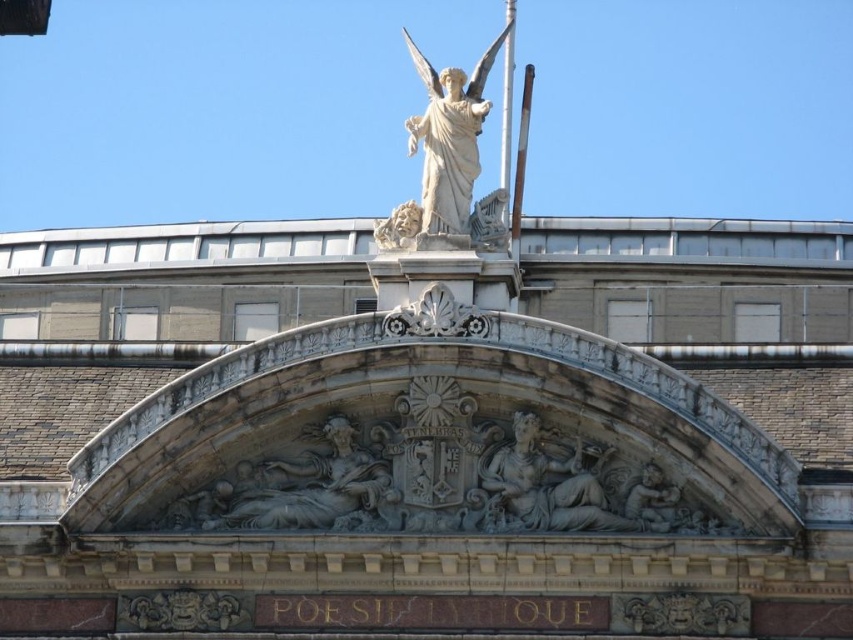
You are an architect analyzing the symmetry of the classical structure. The central relief has two figures. Where is the gray stone reclining figure at center located in terms of coordinates?

The gray stone reclining figure at center is located at coordinates point [547,483].

You are an architect examining the classical structure. You notice two points on the pediment. The first point is at coordinate point [502,113] and the second is at point [526,112]. Which point is positioned closer to your viewpoint?

Point [502,113] is closer to the viewer than point [526,112].

You are an architect examining the structure. You notice the gray stone reclining figure at center and the metallic flagpole at upper center. Which object is positioned higher in the image?

The metallic flagpole at upper center is positioned higher than the gray stone reclining figure at center.